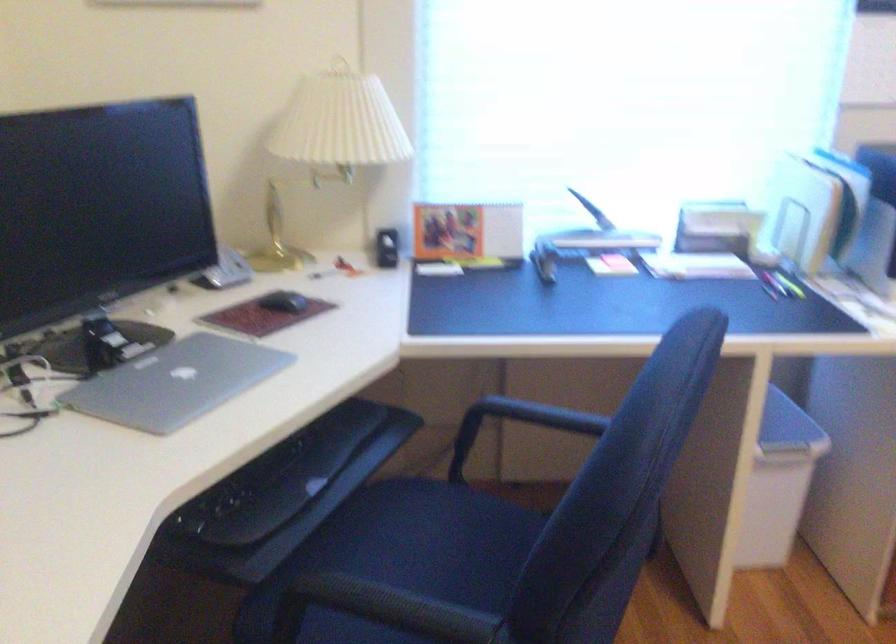
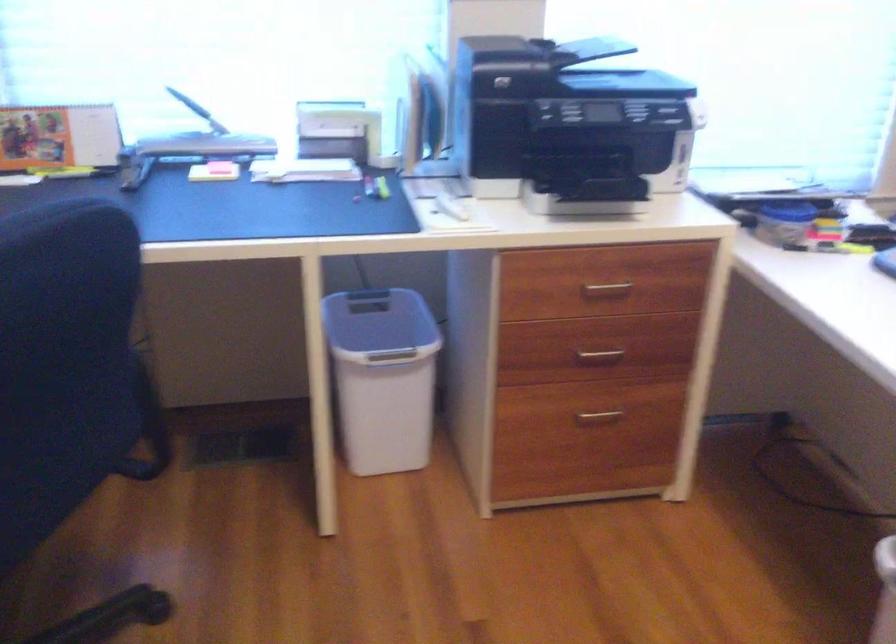
Question: The camera is either moving clockwise (left) or counter-clockwise (right) around the object. The first image is from the beginning of the video and the second image is from the end. Is the camera moving left or right when shooting the video?

Choices:
 (A) Left
 (B) Right

Answer: (A)